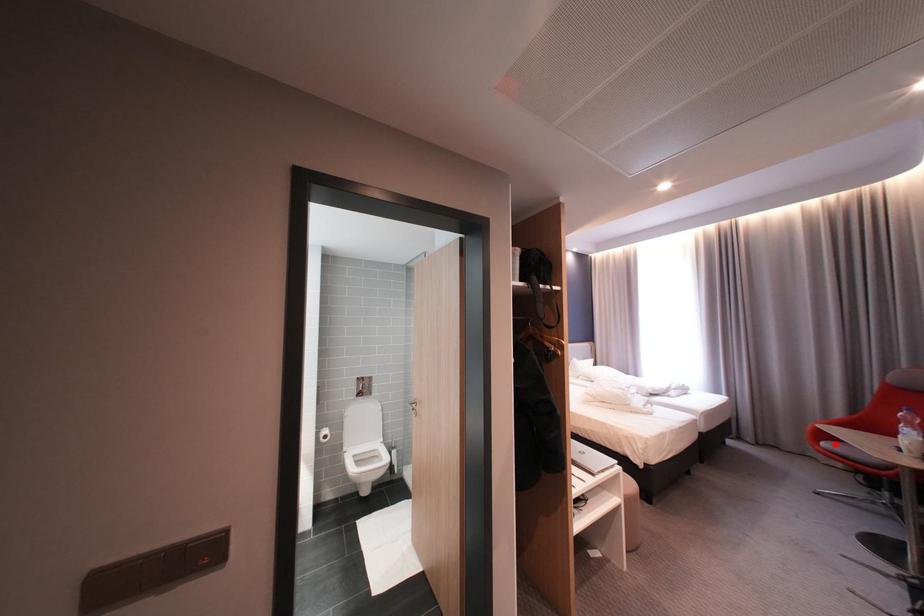
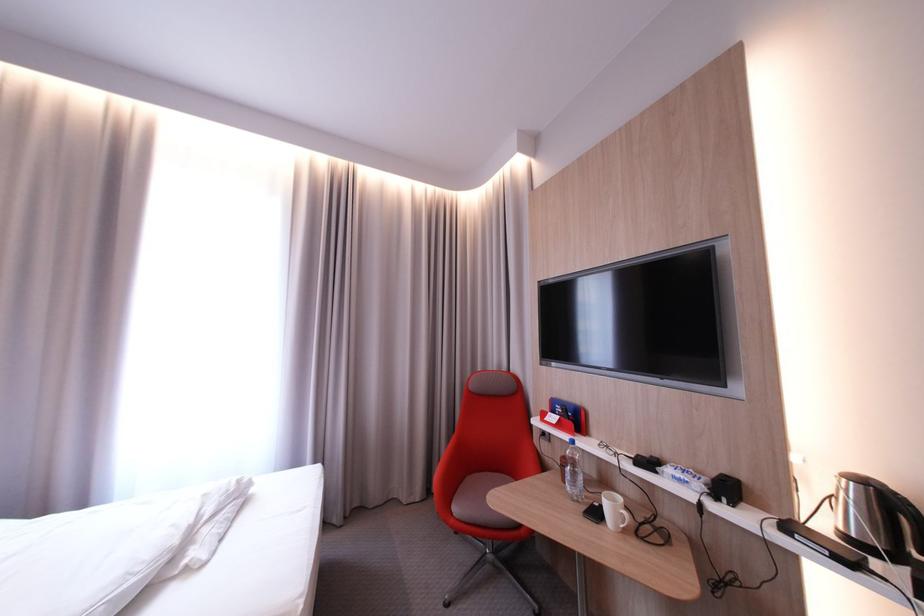
The point at the highlighted location is marked in the first image. Where is the corresponding point in the second image?

(467, 511)